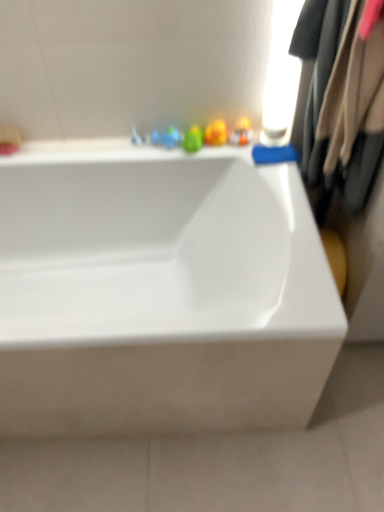
Question: Should I look upward or downward to see translucent plastic toy at upper center?

Choices:
 (A) down
 (B) up

Answer: (B)

Question: From the image's perspective, does white glossy bathtub at center appear lower than translucent plastic toy at upper center?

Choices:
 (A) yes
 (B) no

Answer: (A)

Question: From the image's perspective, is white glossy bathtub at center on top of translucent plastic toy at upper center?

Choices:
 (A) no
 (B) yes

Answer: (A)

Question: From a real-world perspective, does white glossy bathtub at center sit lower than translucent plastic toy at upper center?

Choices:
 (A) yes
 (B) no

Answer: (A)

Question: Is white glossy bathtub at center looking in the opposite direction of translucent plastic toy at upper center?

Choices:
 (A) yes
 (B) no

Answer: (B)

Question: Is white glossy bathtub at center thinner than translucent plastic toy at upper center?

Choices:
 (A) yes
 (B) no

Answer: (B)

Question: Does white glossy bathtub at center have a larger size compared to translucent plastic toy at upper center?

Choices:
 (A) yes
 (B) no

Answer: (A)

Question: Does translucent plastic toy at upper center have a lesser width compared to beige fabric coat at right?

Choices:
 (A) yes
 (B) no

Answer: (A)

Question: From a real-world perspective, is translucent plastic toy at upper center on beige fabric coat at right?

Choices:
 (A) yes
 (B) no

Answer: (B)

Question: Is translucent plastic toy at upper center at the left side of beige fabric coat at right?

Choices:
 (A) no
 (B) yes

Answer: (B)

Question: Is translucent plastic toy at upper center aimed at beige fabric coat at right?

Choices:
 (A) yes
 (B) no

Answer: (B)

Question: Does translucent plastic toy at upper center have a lesser height compared to beige fabric coat at right?

Choices:
 (A) no
 (B) yes

Answer: (B)

Question: From the image's perspective, would you say translucent plastic toy at upper center is shown under beige fabric coat at right?

Choices:
 (A) yes
 (B) no

Answer: (B)

Question: Is white glossy bathtub at center positioned far away from beige fabric coat at right?

Choices:
 (A) no
 (B) yes

Answer: (A)